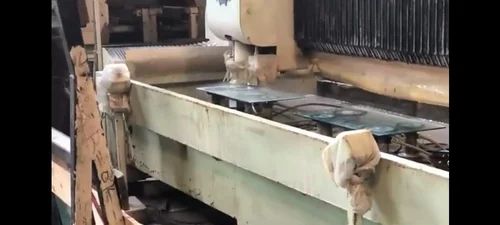
Where is `step ladder`? step ladder is located at coordinates (72, 36), (94, 136), (74, 210).